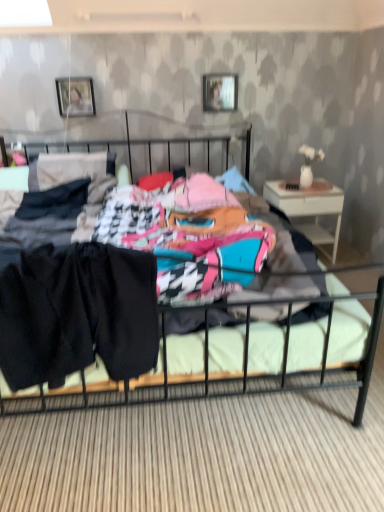
Question: Should I look upward or downward to see white wood nightstand at right?

Choices:
 (A) up
 (B) down

Answer: (A)

Question: Is black fabric shorts at center at the left side of white wood nightstand at right?

Choices:
 (A) yes
 (B) no

Answer: (A)

Question: Considering the relative sizes of black fabric shorts at center and white wood nightstand at right in the image provided, is black fabric shorts at center shorter than white wood nightstand at right?

Choices:
 (A) no
 (B) yes

Answer: (B)

Question: Does black fabric shorts at center come behind white wood nightstand at right?

Choices:
 (A) yes
 (B) no

Answer: (B)

Question: Could you tell me if black fabric shorts at center is facing white wood nightstand at right?

Choices:
 (A) no
 (B) yes

Answer: (A)

Question: From the image's perspective, is black fabric shorts at center under white wood nightstand at right?

Choices:
 (A) no
 (B) yes

Answer: (B)

Question: Is black fabric shorts at center not near white wood nightstand at right?

Choices:
 (A) no
 (B) yes

Answer: (B)

Question: Considering the relative positions of black fabric shorts at center and metallic silver picture frame at upper center, the 1th picture frame from the right, in the image provided, is black fabric shorts at center behind metallic silver picture frame at upper center, the 1th picture frame from the right,?

Choices:
 (A) yes
 (B) no

Answer: (B)

Question: Is black fabric shorts at center positioned far away from metallic silver picture frame at upper center, which is the 2th picture frame from left to right?

Choices:
 (A) yes
 (B) no

Answer: (A)

Question: Is black fabric shorts at center taller than metallic silver picture frame at upper center, which is the 2th picture frame from left to right?

Choices:
 (A) yes
 (B) no

Answer: (A)

Question: From a real-world perspective, is black fabric shorts at center beneath metallic silver picture frame at upper center, the 1th picture frame from the right?

Choices:
 (A) no
 (B) yes

Answer: (B)

Question: Can you confirm if black fabric shorts at center is smaller than metallic silver picture frame at upper center, the 1th picture frame from the right?

Choices:
 (A) yes
 (B) no

Answer: (B)

Question: Can you confirm if black fabric shorts at center is shorter than metallic silver picture frame at upper center, which is the 2th picture frame from left to right?

Choices:
 (A) yes
 (B) no

Answer: (B)

Question: Does metallic silver picture frame at upper center, the 1th picture frame from the right, lie behind black fabric shorts at center?

Choices:
 (A) yes
 (B) no

Answer: (A)